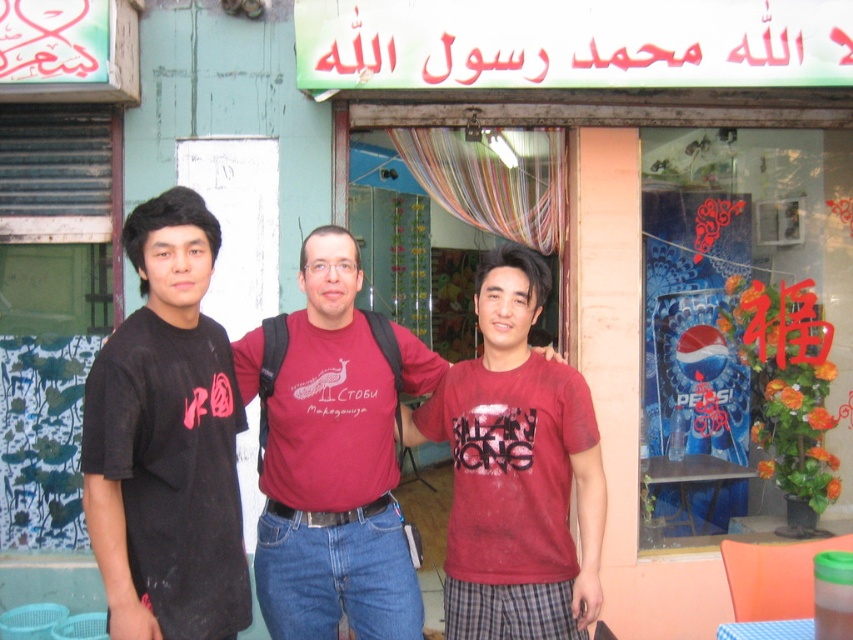
Is black matte t-shirt at left closer to the viewer compared to black matte t-shirt at center?

Yes, black matte t-shirt at left is closer to the viewer.

Identify the location of black matte t-shirt at left. The height and width of the screenshot is (640, 853). (166, 442).

Does maroon cotton t-shirt at center have a lesser width compared to black matte t-shirt at center?

Yes.

Locate an element on the screen. The height and width of the screenshot is (640, 853). maroon cotton t-shirt at center is located at coordinates (515, 470).

Find the location of `maroon cotton t-shirt at center`. maroon cotton t-shirt at center is located at coordinates (515, 470).

Can you confirm if black matte t-shirt at left is shorter than maroon cotton t-shirt at center?

Correct, black matte t-shirt at left is not as tall as maroon cotton t-shirt at center.

Between black matte t-shirt at left and maroon cotton t-shirt at center, which one is positioned lower?

maroon cotton t-shirt at center is below.

Who is more forward, (157,532) or (582,636)?

Point (157,532)

Image resolution: width=853 pixels, height=640 pixels. In order to click on black matte t-shirt at left in this screenshot , I will do pyautogui.click(x=166, y=442).